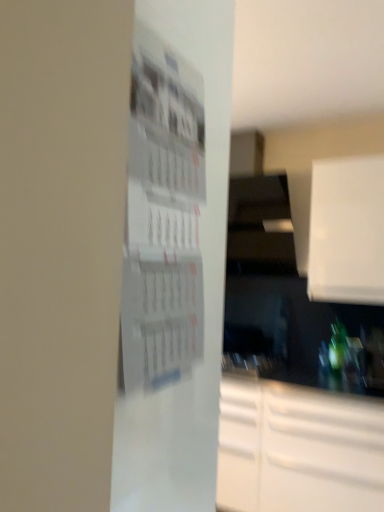
Question: Is white matte cabinet at upper right to the right of white paper at center from the viewer's perspective?

Choices:
 (A) yes
 (B) no

Answer: (A)

Question: Considering the relative sizes of white matte cabinet at upper right and white paper at center in the image provided, is white matte cabinet at upper right shorter than white paper at center?

Choices:
 (A) no
 (B) yes

Answer: (A)

Question: Is white matte cabinet at upper right turned away from white paper at center?

Choices:
 (A) yes
 (B) no

Answer: (B)

Question: From a real-world perspective, is white matte cabinet at upper right below white paper at center?

Choices:
 (A) no
 (B) yes

Answer: (A)

Question: Could you tell me if white matte cabinet at upper right is turned towards white paper at center?

Choices:
 (A) yes
 (B) no

Answer: (A)

Question: Does white matte cabinet at upper right have a lesser width compared to white paper at center?

Choices:
 (A) no
 (B) yes

Answer: (A)

Question: Considering the relative sizes of green glass bottle at lower right and white paper at center in the image provided, is green glass bottle at lower right bigger than white paper at center?

Choices:
 (A) yes
 (B) no

Answer: (B)

Question: From a real-world perspective, does green glass bottle at lower right sit lower than white paper at center?

Choices:
 (A) no
 (B) yes

Answer: (B)

Question: From the image's perspective, would you say green glass bottle at lower right is shown under white paper at center?

Choices:
 (A) yes
 (B) no

Answer: (A)

Question: Is green glass bottle at lower right taller than white paper at center?

Choices:
 (A) no
 (B) yes

Answer: (A)

Question: Is green glass bottle at lower right wider than white paper at center?

Choices:
 (A) yes
 (B) no

Answer: (A)

Question: Does green glass bottle at lower right have a smaller size compared to white paper at center?

Choices:
 (A) no
 (B) yes

Answer: (B)

Question: Is the depth of white paper at center greater than that of white matte cabinet at upper right?

Choices:
 (A) yes
 (B) no

Answer: (B)